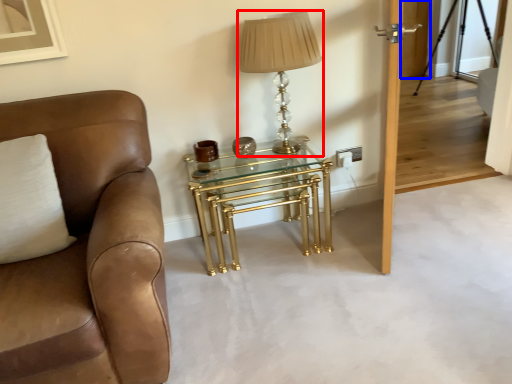
Question: Which point is closer to the camera, table lamp (highlighted by a red box) or glass door (highlighted by a blue box)?

Choices:
 (A) table lamp
 (B) glass door

Answer: (A)